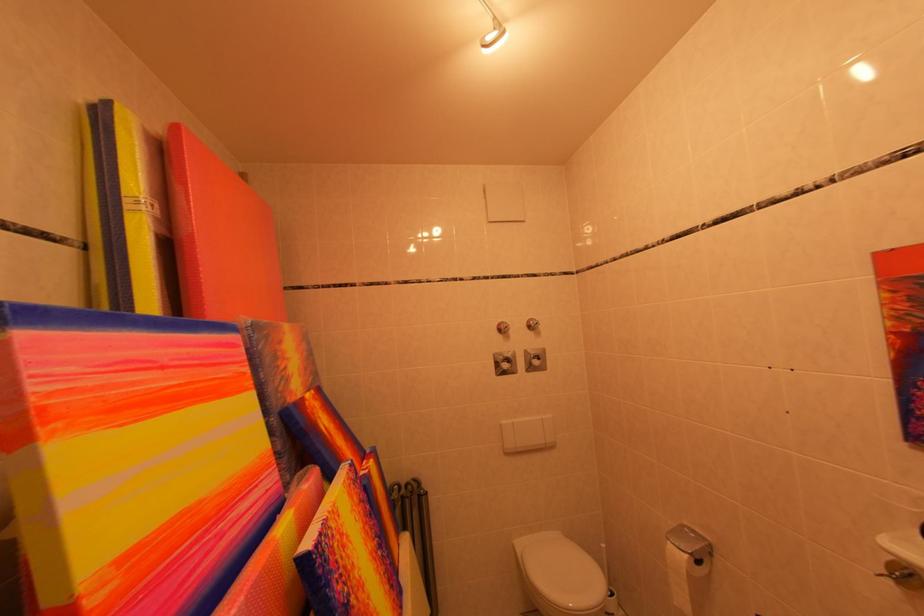
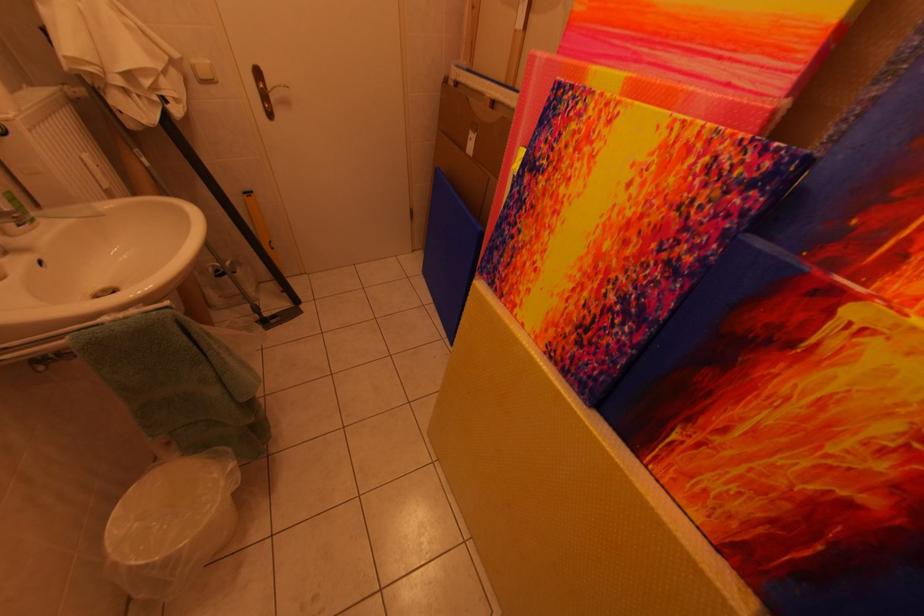
Locate, in the second image, the point that corresponds to [269,490] in the first image.

(734, 68)